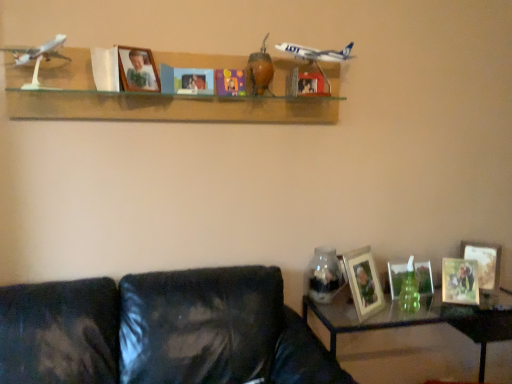
This screenshot has height=384, width=512. I want to click on free spot below matte wooden picture frame at center, the 6th picture frame viewed from the right (from a real-world perspective), so click(193, 273).